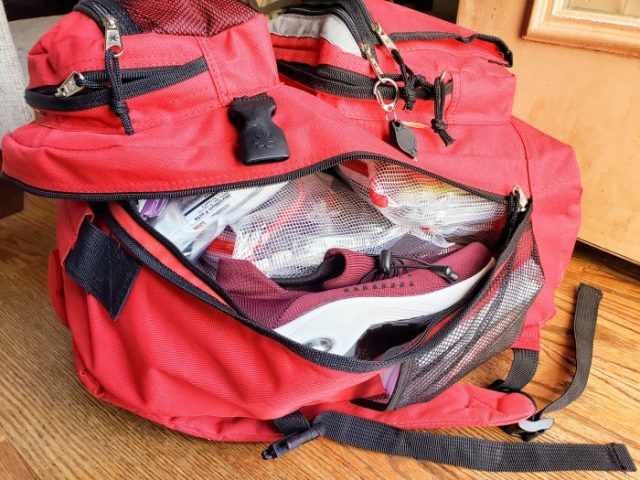
Find the location of a particular element. The height and width of the screenshot is (480, 640). shoe is located at coordinates (353, 295).